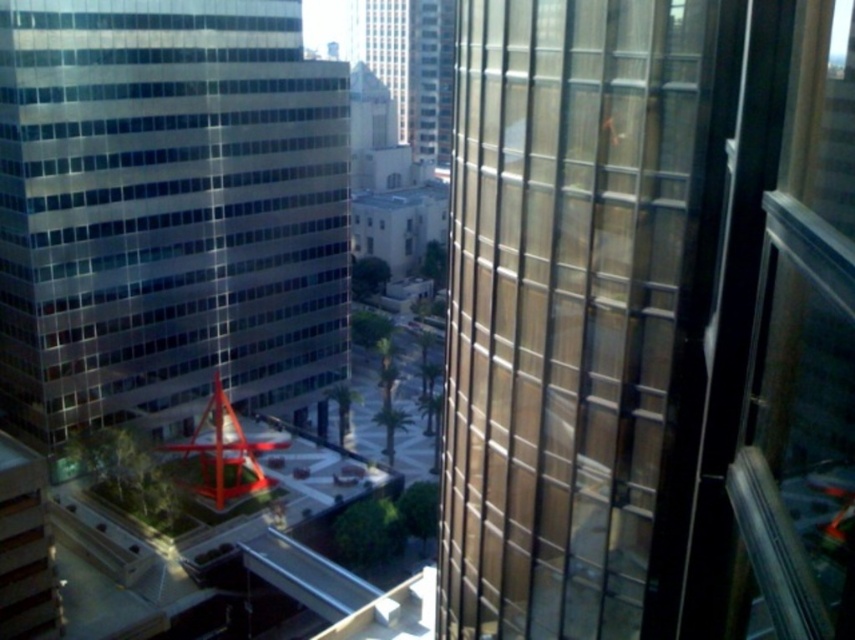
You are standing inside the high rise building and want to take a photo of the transparent glass building at left and the glassy reflective skyscraper at center. Which one is positioned more to the left side from your current viewpoint?

The transparent glass building at left is positioned more to the left side from your current viewpoint compared to the glassy reflective skyscraper at center.

You are standing inside the high rise building and want to walk to the plaza outside. Which object, the transparent glass building at left or the glassy reflective skyscraper at center, would you encounter first when exiting the building?

You would encounter the transparent glass building at left first because it is closer to you than the glassy reflective skyscraper at center.